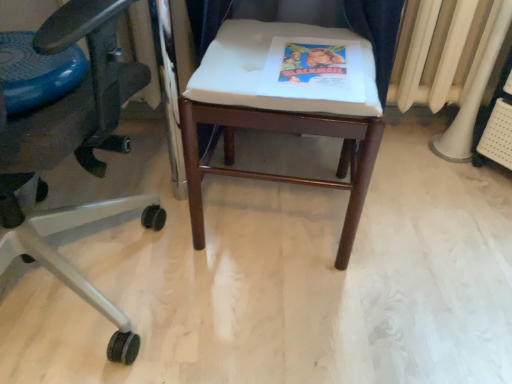
Question: Considering their positions, is white fabric stool at center located in front of or behind matte black office chair at left?

Choices:
 (A) behind
 (B) front

Answer: (A)

Question: In terms of size, does white fabric stool at center appear bigger or smaller than matte black office chair at left?

Choices:
 (A) big
 (B) small

Answer: (B)

Question: Considering the real-world distances, which object is farthest from the matte paper book at center?

Choices:
 (A) blue rubber ball at left
 (B) white plastic radiator at right
 (C) white fabric stool at center
 (D) matte black office chair at left

Answer: (B)

Question: Estimate the real-world distances between objects in this image. Which object is farther from the matte paper book at center?

Choices:
 (A) white plastic radiator at right
 (B) white fabric stool at center
 (C) matte black office chair at left
 (D) blue rubber ball at left

Answer: (A)